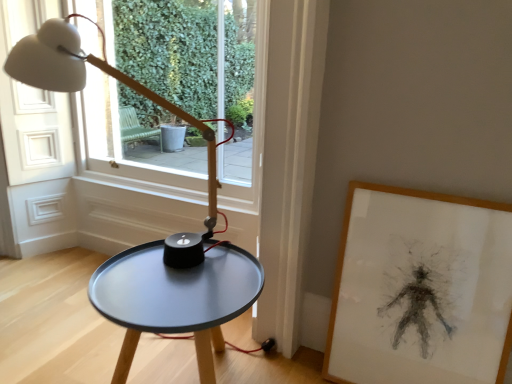
Question: Are wooden framed drawing at right and matte black table at center far apart?

Choices:
 (A) no
 (B) yes

Answer: (A)

Question: Is wooden framed drawing at right at the right side of matte black table at center?

Choices:
 (A) no
 (B) yes

Answer: (B)

Question: From a real-world perspective, does wooden framed drawing at right sit lower than matte black table at center?

Choices:
 (A) no
 (B) yes

Answer: (A)

Question: Can you confirm if wooden framed drawing at right is positioned to the left of matte black table at center?

Choices:
 (A) yes
 (B) no

Answer: (B)

Question: Considering the relative sizes of wooden framed drawing at right and matte black table at center in the image provided, is wooden framed drawing at right taller than matte black table at center?

Choices:
 (A) no
 (B) yes

Answer: (B)

Question: From the image's perspective, is wooden framed drawing at right over matte black table at center?

Choices:
 (A) yes
 (B) no

Answer: (A)

Question: Is transparent glass window at upper center at the right side of matte black table at center?

Choices:
 (A) no
 (B) yes

Answer: (A)

Question: From the image's perspective, does transparent glass window at upper center appear lower than matte black table at center?

Choices:
 (A) yes
 (B) no

Answer: (B)

Question: Is transparent glass window at upper center at the left side of matte black table at center?

Choices:
 (A) yes
 (B) no

Answer: (A)

Question: Would you say transparent glass window at upper center is a long distance from matte black table at center?

Choices:
 (A) no
 (B) yes

Answer: (A)

Question: From the image's perspective, does transparent glass window at upper center appear higher than matte black table at center?

Choices:
 (A) no
 (B) yes

Answer: (B)

Question: Is transparent glass window at upper center shorter than matte black table at center?

Choices:
 (A) yes
 (B) no

Answer: (B)

Question: Does wooden framed drawing at right have a greater height compared to transparent glass window at upper center?

Choices:
 (A) no
 (B) yes

Answer: (A)